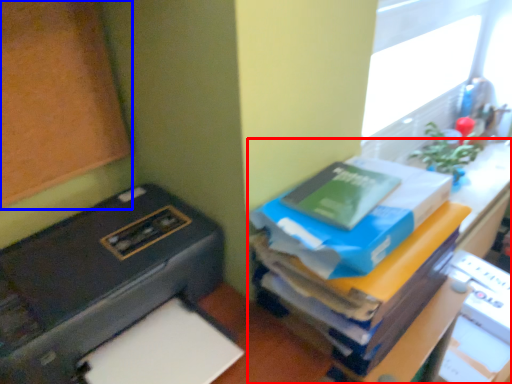
Question: Among these objects, which one is nearest to the camera, furniture (highlighted by a red box) or bulletin board (highlighted by a blue box)?

Choices:
 (A) furniture
 (B) bulletin board

Answer: (B)